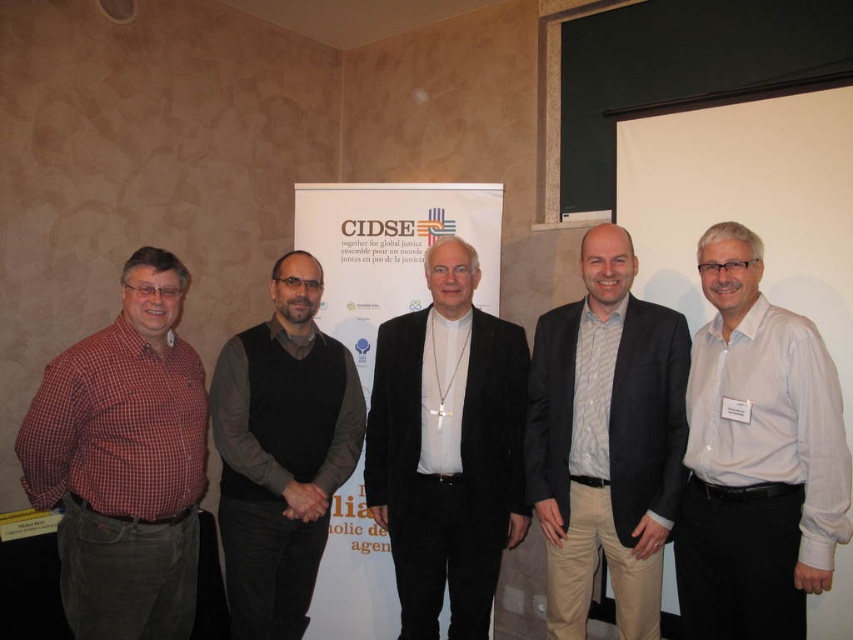
Question: Is red checkered shirt at left positioned before light beige cotton pants at center?

Choices:
 (A) yes
 (B) no

Answer: (A)

Question: Estimate the real-world distances between objects in this image. Which object is closer to the light beige cotton pants at center?

Choices:
 (A) white shirt at center
 (B) dark gray sweater at center

Answer: (A)

Question: Is velvet black suit at center smaller than white matte projector screen at upper right?

Choices:
 (A) yes
 (B) no

Answer: (A)

Question: Which object is closer to the camera taking this photo?

Choices:
 (A) red checkered shirt at left
 (B) velvet black suit at center

Answer: (A)

Question: Can you confirm if red checkered shirt at left is positioned above light beige cotton pants at center?

Choices:
 (A) no
 (B) yes

Answer: (A)

Question: Which is nearer to the white matte projector screen at upper right?

Choices:
 (A) white shirt at center
 (B) dark gray sweater at center
 (C) light beige cotton pants at center
 (D) velvet black suit at center

Answer: (C)